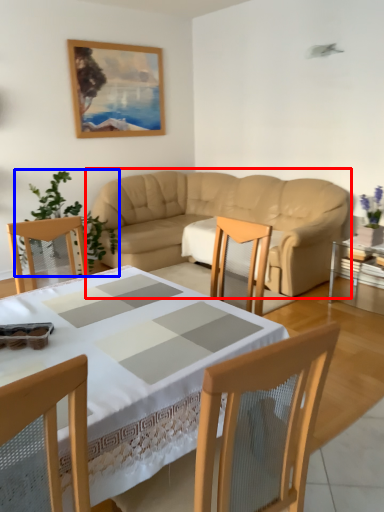
Question: Which of the following is the closest to the observer, studio couch (highlighted by a red box) or plant (highlighted by a blue box)?

Choices:
 (A) studio couch
 (B) plant

Answer: (A)